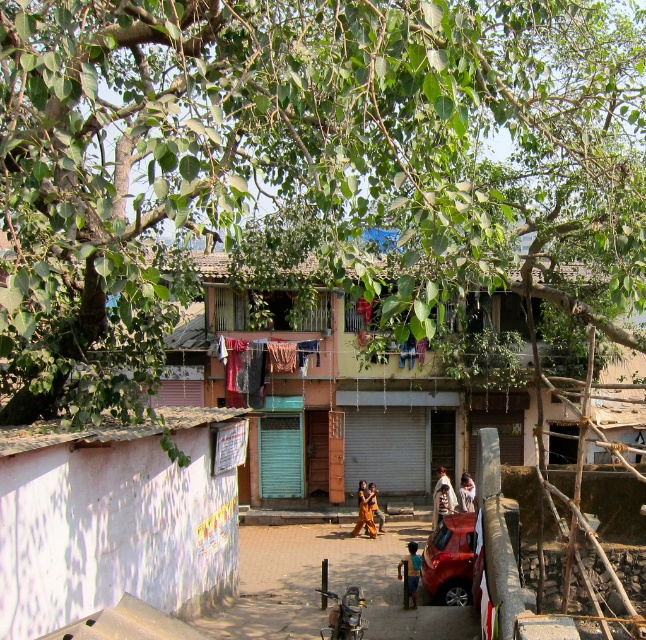
Between green leafy tree at upper center and dark blue fabric at center, which one has less height?

dark blue fabric at center

Is green leafy tree at upper center closer to the viewer compared to dark blue fabric at center?

That is True.

Does point (193, 13) lie in front of point (401, 561)?

Yes, point (193, 13) is closer to viewer.

Image resolution: width=646 pixels, height=640 pixels. What are the coordinates of `green leafy tree at upper center` in the screenshot? It's located at (306, 168).

Is white matte wall at lower left to the left of multicolored fabric at center from the viewer's perspective?

Yes, white matte wall at lower left is to the left of multicolored fabric at center.

Can you confirm if white matte wall at lower left is thinner than multicolored fabric at center?

Yes.

Who is more distant from viewer, (x=1, y=488) or (x=238, y=364)?

Point (x=238, y=364)

Find the location of a particular element. white matte wall at lower left is located at coordinates (116, 518).

Can you confirm if dark blue fabric at center is bigger than orange fabric at center?

Actually, dark blue fabric at center might be smaller than orange fabric at center.

Is point (408, 584) more distant than point (377, 515)?

No.

You are a GUI agent. You are given a task and a screenshot of the screen. Output one action in this format:
    pyautogui.click(x=<x>, y=<y>)
    Task: Click on the dark blue fabric at center
    
    Given the screenshot: What is the action you would take?
    pyautogui.click(x=410, y=570)